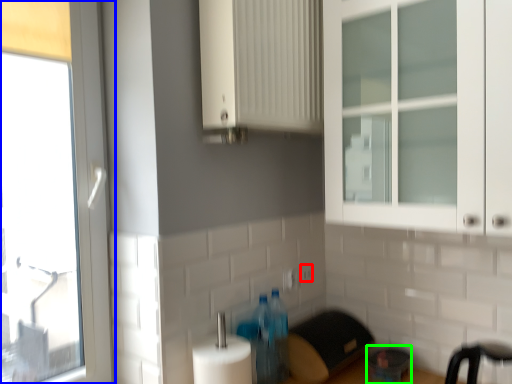
Question: Considering the real-world distances, which object is farthest from electric outlet (highlighted by a red box)? window (highlighted by a blue box) or appliance (highlighted by a green box)?

Choices:
 (A) window
 (B) appliance

Answer: (A)